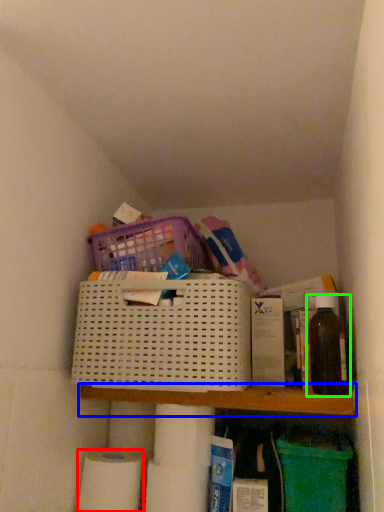
Question: Which object is positioned farthest from toilet paper (highlighted by a red box)? Select from shelf (highlighted by a blue box) and bottle (highlighted by a green box).

Choices:
 (A) shelf
 (B) bottle

Answer: (B)